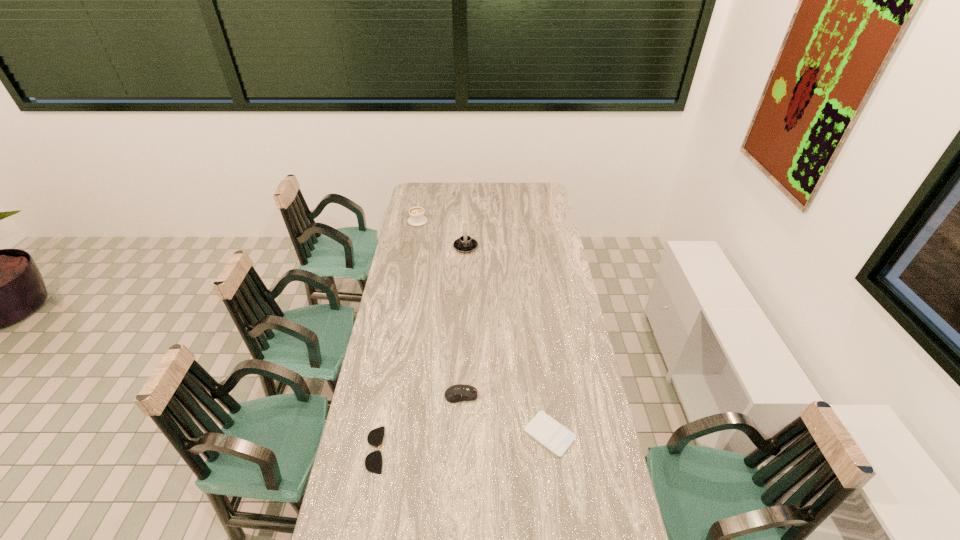
The image size is (960, 540). What are the coordinates of `the tallest object` in the screenshot? It's located at (465, 244).

Find the location of a particular element. The width and height of the screenshot is (960, 540). candle holder is located at coordinates (465, 244).

At what (x,y) coordinates should I click in order to perform the action: click on cappuccino. Please return your answer as a coordinate pair (x, y). Image resolution: width=960 pixels, height=540 pixels. Looking at the image, I should click on (417, 218).

This screenshot has height=540, width=960. I want to click on the fourth shortest object, so click(417, 218).

Locate an element on the screen. the third shortest object is located at coordinates (460, 392).

You are a GUI agent. You are given a task and a screenshot of the screen. Output one action in this format:
    pyautogui.click(x=<x>, y=<y>)
    Task: Click on the third nearest object
    Image resolution: width=960 pixels, height=540 pixels.
    Given the screenshot: What is the action you would take?
    pyautogui.click(x=460, y=392)

Locate an element on the screen. Image resolution: width=960 pixels, height=540 pixels. calculator is located at coordinates (555, 437).

Locate an element on the screen. The height and width of the screenshot is (540, 960). spectacles is located at coordinates (373, 462).

Locate an element on the screen. vacant point located 0.260m with a handle on the side of the tallest object is located at coordinates (467, 212).

The image size is (960, 540). What are the coordinates of `blank space located 0.230m with a handle on the side of the tallest object` in the screenshot? It's located at (467, 215).